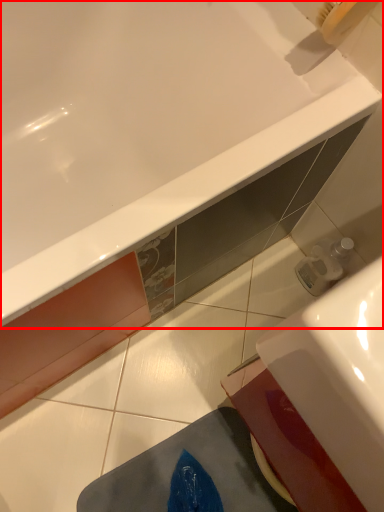
Question: From the image's perspective, what is the correct spatial relationship of bathtub (annotated by the red box) in relation to sink?

Choices:
 (A) above
 (B) below

Answer: (A)